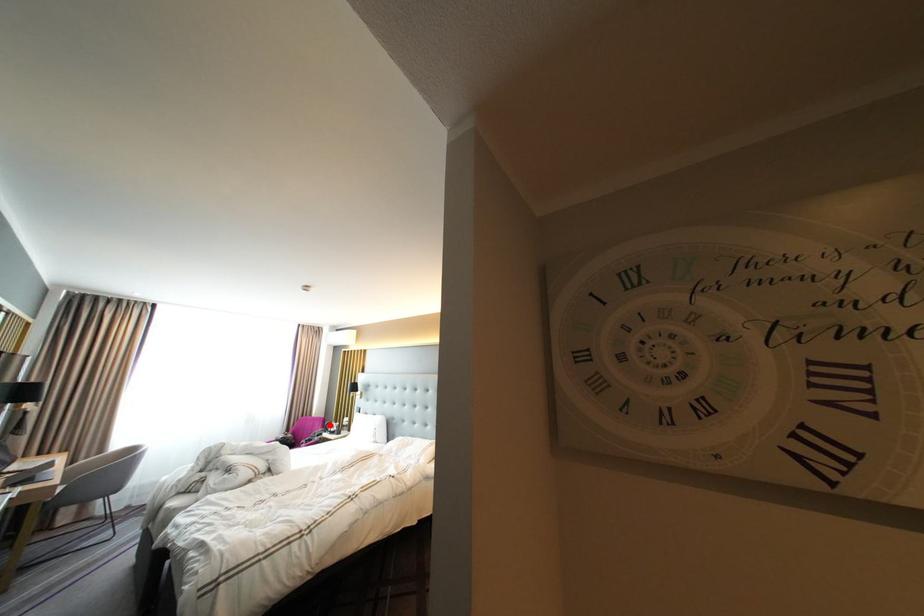
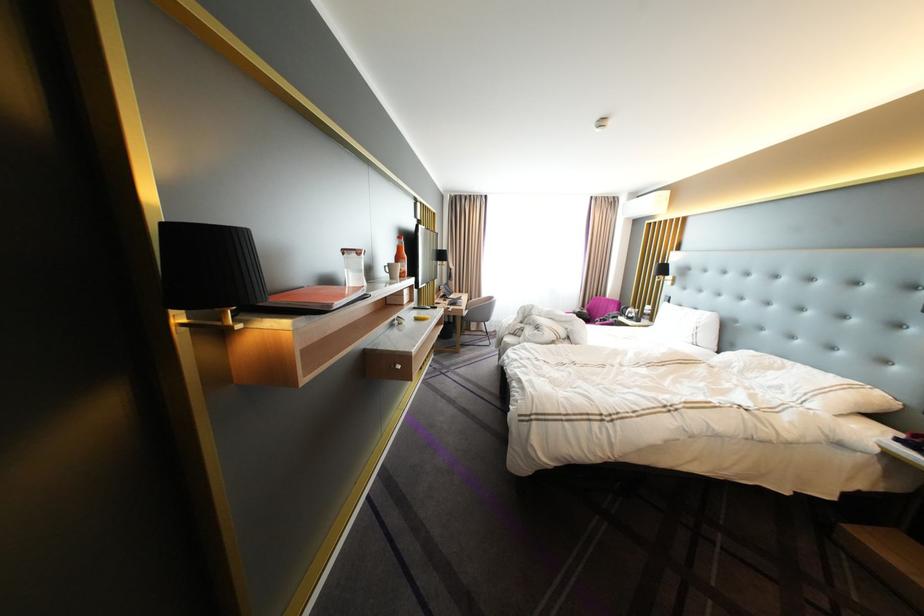
Question: I am providing you with two images of the same scene from different viewpoints. A red point is shown in image1. For the corresponding object point in image2, is it positioned nearer or farther from the camera?

Choices:
 (A) Nearer
 (B) Farther

Answer: (A)